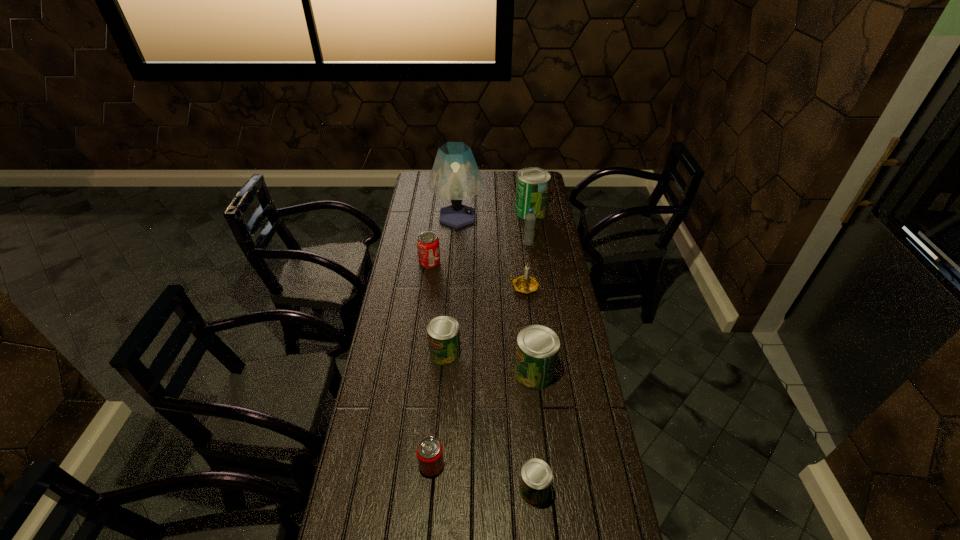
Where is `object that is the eighth closest to the nearer red can`? The height and width of the screenshot is (540, 960). object that is the eighth closest to the nearer red can is located at coordinates (532, 188).

Identify the location of can that stands as the second closest to the candle holder. (443, 332).

You are a GUI agent. You are given a task and a screenshot of the screen. Output one action in this format:
    pyautogui.click(x=<x>, y=<y>)
    Task: Click on the closest can relative to the farther red can
    The width and height of the screenshot is (960, 540).
    Given the screenshot: What is the action you would take?
    pyautogui.click(x=443, y=332)

Locate an element on the screen. the fourth closest green can to the smaller red can is located at coordinates (532, 188).

Locate an element on the screen. The height and width of the screenshot is (540, 960). green can that is the third closest to the light lampshade is located at coordinates (537, 350).

Locate an element on the screen. vacant position in the image that satisfies the following two spatial constraints: 1. on the base of the tallest object; 2. on the right side of the third farthest object is located at coordinates pos(456,244).

Locate an element on the screen. The height and width of the screenshot is (540, 960). blank space that satisfies the following two spatial constraints: 1. on the back side of the gold candle holder; 2. on the left side of the farthest green can is located at coordinates (516, 211).

Find the location of a particular element. Image resolution: width=960 pixels, height=540 pixels. free space in the image that satisfies the following two spatial constraints: 1. on the base of the light lampshade; 2. on the right side of the second tallest can is located at coordinates (446, 373).

The image size is (960, 540). I want to click on vacant space that satisfies the following two spatial constraints: 1. on the base of the candle holder; 2. on the left side of the tallest object, so click(x=452, y=287).

At what (x,y) coordinates should I click in order to perform the action: click on blank space that satisfies the following two spatial constraints: 1. on the front side of the third smallest green can; 2. on the right side of the candle holder. Please return your answer as a coordinate pair (x, y). The image size is (960, 540). Looking at the image, I should click on (533, 373).